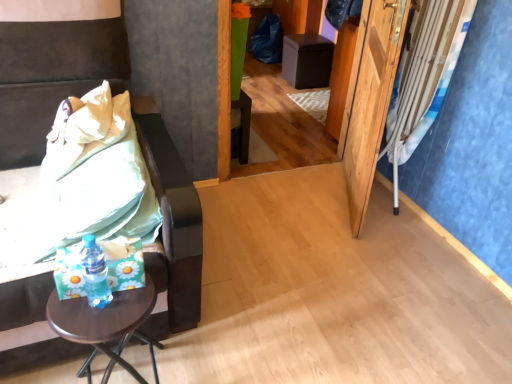
Question: Does green fabric bedsheet at left have a greater width compared to translucent plastic bottle at lower left?

Choices:
 (A) yes
 (B) no

Answer: (A)

Question: Are green fabric bedsheet at left and translucent plastic bottle at lower left far apart?

Choices:
 (A) no
 (B) yes

Answer: (A)

Question: Does green fabric bedsheet at left have a greater height compared to translucent plastic bottle at lower left?

Choices:
 (A) yes
 (B) no

Answer: (A)

Question: Can you confirm if green fabric bedsheet at left is thinner than translucent plastic bottle at lower left?

Choices:
 (A) no
 (B) yes

Answer: (A)

Question: Would you say green fabric bedsheet at left is outside translucent plastic bottle at lower left?

Choices:
 (A) no
 (B) yes

Answer: (B)

Question: From the image's perspective, relative to brown wooden table at lower left, is blue fabric curtain at right above or below?

Choices:
 (A) below
 (B) above

Answer: (B)

Question: Is blue fabric curtain at right situated inside brown wooden table at lower left or outside?

Choices:
 (A) outside
 (B) inside

Answer: (A)

Question: Looking at their shapes, would you say blue fabric curtain at right is wider or thinner than brown wooden table at lower left?

Choices:
 (A) wide
 (B) thin

Answer: (B)

Question: Is blue fabric curtain at right to the left or to the right of brown wooden table at lower left in the image?

Choices:
 (A) left
 (B) right

Answer: (B)

Question: Considering the positions of wooden screen door at right and green fabric bedsheet at left in the image, is wooden screen door at right wider or thinner than green fabric bedsheet at left?

Choices:
 (A) thin
 (B) wide

Answer: (A)

Question: Relative to green fabric bedsheet at left, is wooden screen door at right in front or behind?

Choices:
 (A) behind
 (B) front

Answer: (A)

Question: Would you say wooden screen door at right is inside or outside green fabric bedsheet at left?

Choices:
 (A) outside
 (B) inside

Answer: (A)

Question: From a real-world perspective, relative to green fabric bedsheet at left, is wooden screen door at right vertically above or below?

Choices:
 (A) below
 (B) above

Answer: (B)

Question: In the image, is green fabric bedsheet at left positioned in front of or behind wooden screen door at right?

Choices:
 (A) front
 (B) behind

Answer: (A)

Question: In terms of width, does green fabric bedsheet at left look wider or thinner when compared to wooden screen door at right?

Choices:
 (A) thin
 (B) wide

Answer: (B)